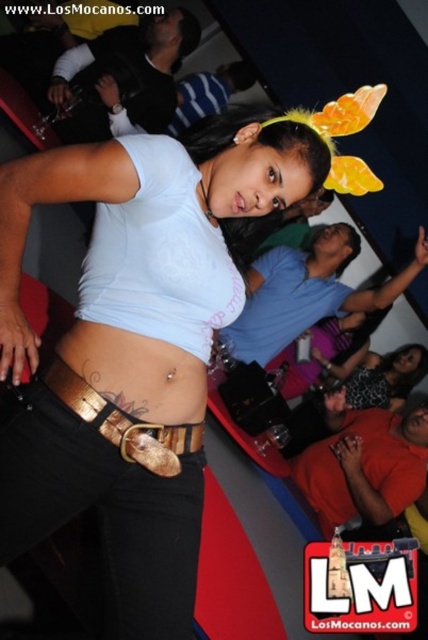
Is point (14, 337) closer to viewer compared to point (359, 390)?

Yes, it is in front of point (359, 390).

Is matte white tank top at center wider than matte black top at center?

Yes.

Locate an element on the screen. matte white tank top at center is located at coordinates (133, 356).

Does matte white tank top at center come in front of gold metallic belt at lower center?

Yes, it is in front of gold metallic belt at lower center.

Is point (220, 211) more distant than point (137, 440)?

Yes, it is behind point (137, 440).

Locate an element on the screen. matte white tank top at center is located at coordinates [x=133, y=356].

Which is behind, point (127, 419) or point (374, 387)?

The point (374, 387) is more distant.

Is point (184, 454) farther from camera compared to point (368, 397)?

No.

In the scene shown: Measure the distance between gold metallic belt at lower center and camera.

They are 3.35 feet apart.

Locate an element on the screen. The width and height of the screenshot is (428, 640). gold metallic belt at lower center is located at coordinates (124, 424).